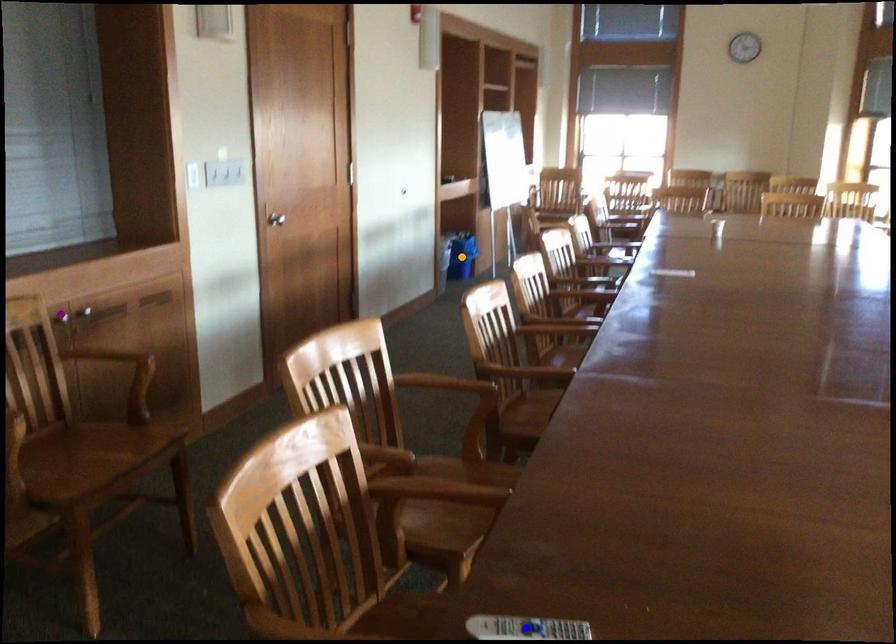
Order these from nearest to farthest:
- purple point
- blue point
- orange point

blue point → purple point → orange point